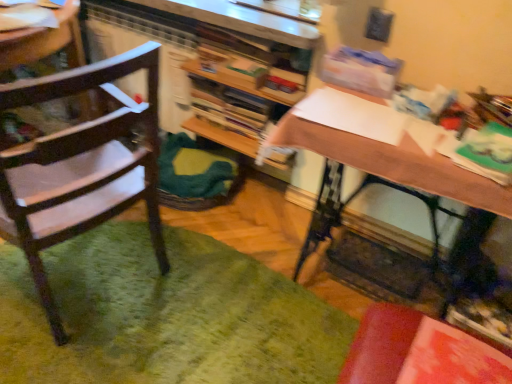
Measure the distance between wooden desk at center and camera.

1.07 meters.

Where is `wooden chair at left`? The width and height of the screenshot is (512, 384). wooden chair at left is located at coordinates (80, 167).

What do you see at coordinates (227, 76) in the screenshot?
I see `wooden bookshelf at center` at bounding box center [227, 76].

Locate an element on the screen. wooden desk at center is located at coordinates (399, 145).

Considering the sizes of objects wooden chair at left and wooden bookshelf at center in the image provided, who is shorter, wooden chair at left or wooden bookshelf at center?

Standing shorter between the two is wooden bookshelf at center.

Would you say wooden chair at left contains wooden bookshelf at center?

No, wooden bookshelf at center is not inside wooden chair at left.

Considering the positions of objects wooden chair at left and wooden bookshelf at center in the image provided, who is more to the left, wooden chair at left or wooden bookshelf at center?

From the viewer's perspective, wooden chair at left appears more on the left side.

Is wooden desk at center positioned before wooden bookshelf at center?

Yes, it is.

How different are the orientations of wooden desk at center and wooden bookshelf at center in degrees?

They differ by 2.22 degrees in their facing directions.

Is wooden desk at center thinner than wooden bookshelf at center?

No.

Is wooden desk at center facing away from wooden bookshelf at center?

wooden desk at center does not have its back to wooden bookshelf at center.

You are a GUI agent. You are given a task and a screenshot of the screen. Output one action in this format:
    pyautogui.click(x=<x>, y=<y>)
    Task: Click on the mat directly beneath the wooden bookshelf at center (from a real-world perspective)
    
    Given the screenshot: What is the action you would take?
    pyautogui.click(x=165, y=316)

Is green fuzzy mat at lower left thinner than wooden bookshelf at center?

No, green fuzzy mat at lower left is not thinner than wooden bookshelf at center.

Is green fuzzy mat at lower left inside or outside of wooden bookshelf at center?

green fuzzy mat at lower left lies outside wooden bookshelf at center.

How different are the orientations of green fuzzy mat at lower left and wooden bookshelf at center in degrees?

green fuzzy mat at lower left and wooden bookshelf at center are facing 88.2 degrees away from each other.

Is point (189, 58) positioned before point (73, 207)?

No, it is behind (73, 207).

In the scene shown: From their relative heights in the image, would you say wooden bookshelf at center is taller or shorter than wooden chair at left?

Considering their sizes, wooden bookshelf at center has less height than wooden chair at left.

Does wooden bookshelf at center have a greater width compared to wooden chair at left?

In fact, wooden bookshelf at center might be narrower than wooden chair at left.

This screenshot has height=384, width=512. What are the coordinates of `mat below the wooden chair at left (from the image's perspective)` in the screenshot? It's located at (165, 316).

Would you say green fuzzy mat at lower left is outside wooden chair at left?

That's correct, green fuzzy mat at lower left is outside of wooden chair at left.

Considering the sizes of objects green fuzzy mat at lower left and wooden chair at left in the image provided, who is taller, green fuzzy mat at lower left or wooden chair at left?

wooden chair at left.

Does green fuzzy mat at lower left have a larger size compared to wooden chair at left?

Incorrect, green fuzzy mat at lower left is not larger than wooden chair at left.

Is wooden chair at left looking in the opposite direction of green fuzzy mat at lower left?

Yes, wooden chair at left is positioned with its back facing green fuzzy mat at lower left.

Looking at the image, does wooden chair at left seem bigger or smaller compared to green fuzzy mat at lower left?

wooden chair at left is bigger than green fuzzy mat at lower left.

In order to click on chair in front of the green fuzzy mat at lower left in this screenshot , I will do `click(80, 167)`.

What's the angular difference between wooden chair at left and green fuzzy mat at lower left's facing directions?

wooden chair at left and green fuzzy mat at lower left are facing 10.1 degrees away from each other.

Is wooden desk at center wider or thinner than wooden chair at left?

Considering their sizes, wooden desk at center looks slimmer than wooden chair at left.

From a real-world perspective, is wooden desk at center on top of wooden chair at left?

No.

Does point (426, 126) appear closer or farther from the camera than point (140, 148)?

Point (426, 126) is closer to the camera than point (140, 148).

Looking at this image, is wooden desk at center facing away from wooden chair at left?

No, wooden desk at center's orientation is not away from wooden chair at left.

Find the location of a particular element. The width and height of the screenshot is (512, 384). chair in front of the wooden bookshelf at center is located at coordinates tap(80, 167).

Find the location of a particular element. This screenshot has height=384, width=512. bookshelf that is on the left side of wooden desk at center is located at coordinates (227, 76).

From the image, which object appears to be nearer to wooden chair at left, wooden desk at center or green fuzzy mat at lower left?

green fuzzy mat at lower left.

Considering their positions, is green fuzzy mat at lower left positioned further to wooden chair at left than wooden bookshelf at center?

wooden bookshelf at center is positioned further to the anchor wooden chair at left.

Based on their spatial positions, is wooden chair at left or wooden bookshelf at center further from green fuzzy mat at lower left?

The object further to green fuzzy mat at lower left is wooden bookshelf at center.

Estimate the real-world distances between objects in this image. Which object is closer to green fuzzy mat at lower left, wooden bookshelf at center or wooden desk at center?

Based on the image, wooden desk at center appears to be nearer to green fuzzy mat at lower left.

Estimate the real-world distances between objects in this image. Which object is closer to green fuzzy mat at lower left, wooden desk at center or wooden chair at left?

wooden chair at left is closer to green fuzzy mat at lower left.

Estimate the real-world distances between objects in this image. Which object is closer to wooden desk at center, wooden chair at left or wooden bookshelf at center?

wooden bookshelf at center lies closer to wooden desk at center than the other object.

Which object lies nearer to the anchor point wooden chair at left, wooden bookshelf at center or wooden desk at center?

The object closer to wooden chair at left is wooden desk at center.

Which object lies further to the anchor point wooden bookshelf at center, green fuzzy mat at lower left or wooden desk at center?

green fuzzy mat at lower left is positioned further to the anchor wooden bookshelf at center.

This screenshot has height=384, width=512. In order to click on bookshelf located between wooden chair at left and wooden desk at center in the left-right direction in this screenshot , I will do `click(227, 76)`.

Locate an element on the screen. mat between wooden chair at left and wooden desk at center from left to right is located at coordinates (165, 316).

The height and width of the screenshot is (384, 512). Identify the location of bookshelf situated between green fuzzy mat at lower left and wooden desk at center from left to right. (227, 76).

Locate an element on the screen. mat between wooden chair at left and wooden bookshelf at center along the z-axis is located at coordinates (165, 316).